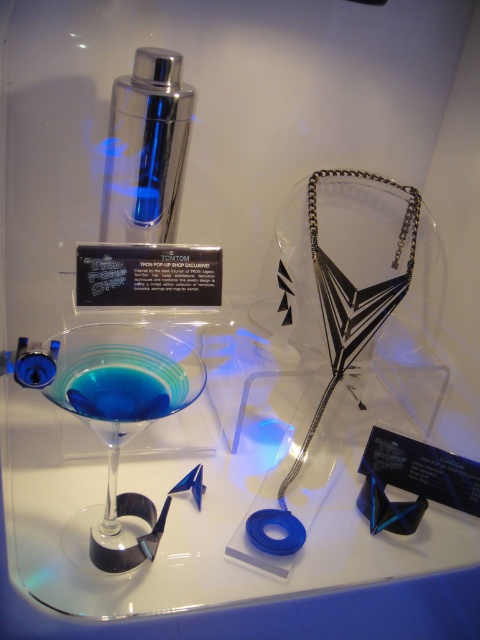
Question: Is transparent glass martini glass at center bigger than blue translucent liquid at lower left?

Choices:
 (A) yes
 (B) no

Answer: (A)

Question: Which of the following is the closest to the observer?

Choices:
 (A) (111, 468)
 (B) (117, 394)
 (C) (149, 227)

Answer: (B)

Question: Can you confirm if transparent glass martini glass at center is bigger than blue translucent liquid at lower left?

Choices:
 (A) no
 (B) yes

Answer: (B)

Question: Which of the following is the closest to the observer?

Choices:
 (A) (132, 340)
 (B) (111, 419)
 (C) (112, 202)

Answer: (B)

Question: Which object appears farthest from the camera in this image?

Choices:
 (A) transparent glass martini glass at center
 (B) shiny metallic cocktail shaker at upper left
 (C) blue translucent liquid at lower left

Answer: (B)

Question: Is transparent glass martini glass at center positioned before blue translucent liquid at lower left?

Choices:
 (A) no
 (B) yes

Answer: (B)